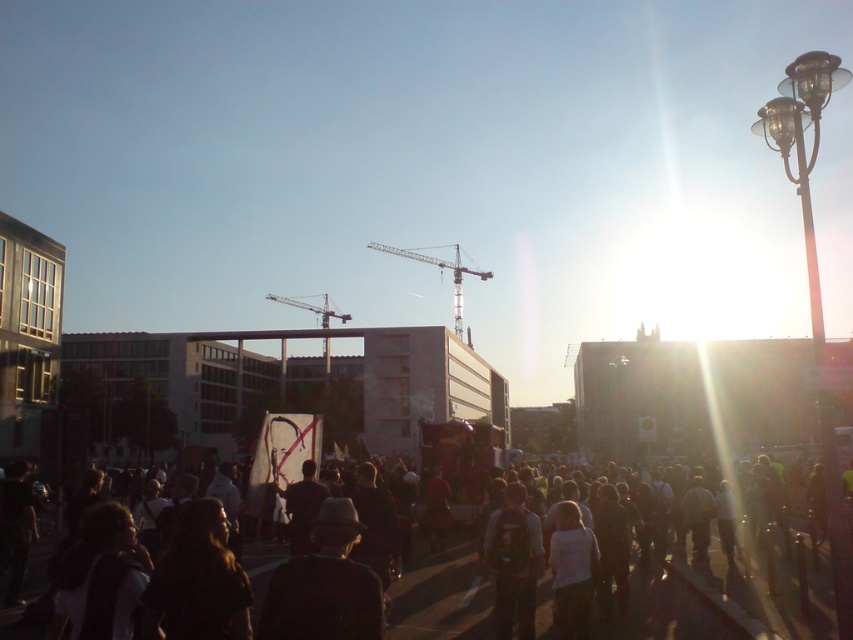
Question: Is metallic silver crane at center to the right of metallic gray crane at center from the viewer's perspective?

Choices:
 (A) yes
 (B) no

Answer: (A)

Question: Which of the following is the farthest from the observer?

Choices:
 (A) metallic silver crane at center
 (B) metallic gray crane at center
 (C) dark brown leather hat at center

Answer: (B)

Question: Is dark clothing at center wider than metallic gray crane at center?

Choices:
 (A) yes
 (B) no

Answer: (B)

Question: Which of these objects is positioned farthest from the dark gray backpack at center?

Choices:
 (A) metallic gray crane at center
 (B) dark clothing at center
 (C) dark brown leather hat at center

Answer: (A)

Question: Which point is closer to the camera taking this photo?

Choices:
 (A) (368, 595)
 (B) (323, 310)

Answer: (A)

Question: Considering the relative positions of dark gray backpack at center and white matte shirt at center in the image provided, where is dark gray backpack at center located with respect to white matte shirt at center?

Choices:
 (A) below
 (B) above

Answer: (B)